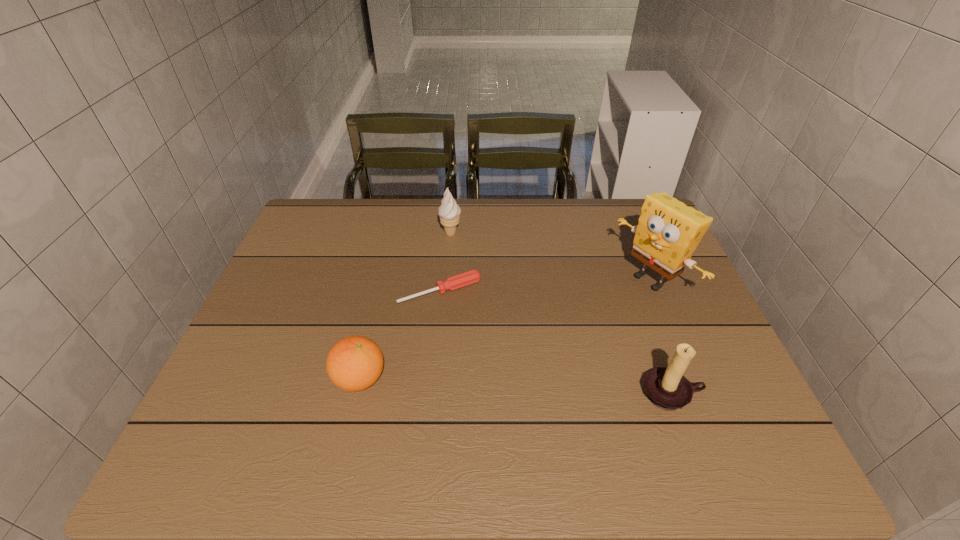
Identify the location of vacant space that satisfies the following two spatial constraints: 1. on the back side of the sponge; 2. on the left side of the screwdriver. 442,280.

The width and height of the screenshot is (960, 540). I want to click on free space that satisfies the following two spatial constraints: 1. on the back side of the second shortest object; 2. on the right side of the shortest object, so click(x=380, y=291).